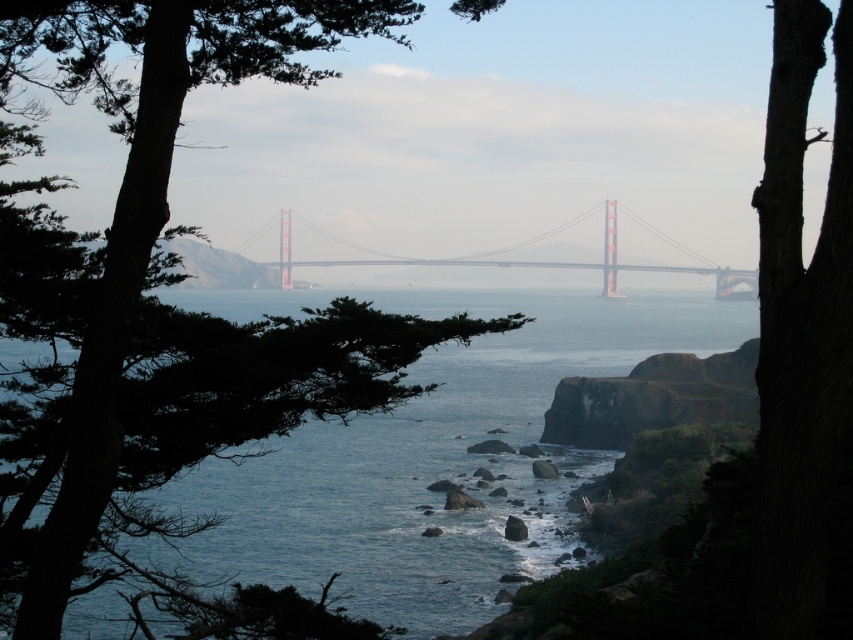
Question: Which is nearer to the blue water at center?

Choices:
 (A) green leafy tree at left
 (B) painted steel bridge at center

Answer: (A)

Question: Can you confirm if green leafy tree at left is positioned above blue water at center?

Choices:
 (A) no
 (B) yes

Answer: (B)

Question: Is blue water at center to the right of painted steel bridge at center from the viewer's perspective?

Choices:
 (A) yes
 (B) no

Answer: (B)

Question: Is the position of green leafy tree at left more distant than that of painted steel bridge at center?

Choices:
 (A) yes
 (B) no

Answer: (B)

Question: Which of the following is the farthest from the observer?

Choices:
 (A) painted steel bridge at center
 (B) green leafy tree at left

Answer: (A)

Question: Which point appears farthest from the camera in this image?

Choices:
 (A) (612, 243)
 (B) (606, 324)
 (C) (352, 404)

Answer: (A)